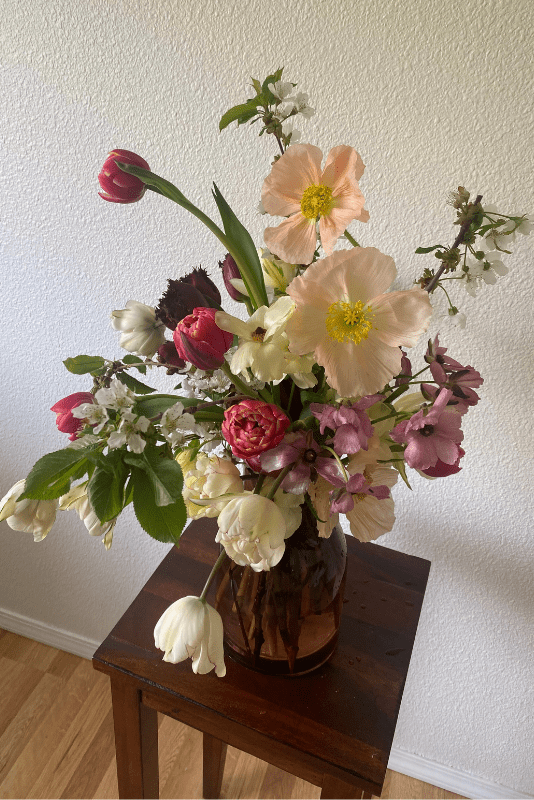
Find the location of a particular element. This screenshot has height=800, width=534. plant stand is located at coordinates (339, 676).